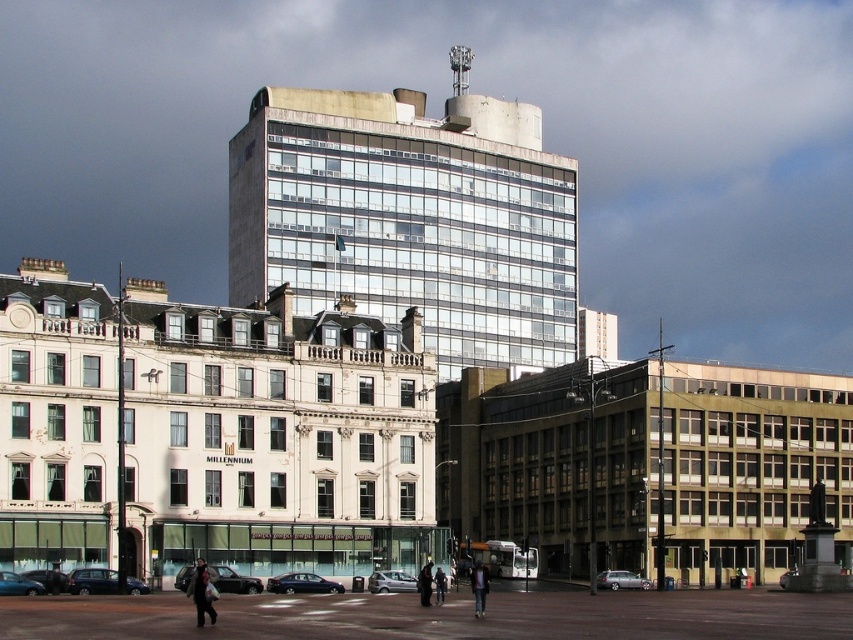
Question: Among these objects, which one is farthest from the camera?

Choices:
 (A) dark gray jacket at center
 (B) dark gray coat at lower center
 (C) clear glass building at center
 (D) white stone building at center

Answer: (C)

Question: Is dark gray jacket at center above dark brown leather jacket at center?

Choices:
 (A) no
 (B) yes

Answer: (A)

Question: Considering the relative positions of dark gray coat at lower center and dark brown leather jacket at center in the image provided, where is dark gray coat at lower center located with respect to dark brown leather jacket at center?

Choices:
 (A) left
 (B) right

Answer: (A)

Question: Does dark gray jacket at center appear over dark brown leather jacket at center?

Choices:
 (A) no
 (B) yes

Answer: (A)

Question: Which point is farther from the camera taking this photo?

Choices:
 (A) (426, 573)
 (B) (196, 557)

Answer: (B)

Question: Based on their relative distances, which object is farther from the white stone building at center?

Choices:
 (A) dark blue jeans at center
 (B) clear glass building at center
 (C) dark gray jacket at center

Answer: (B)